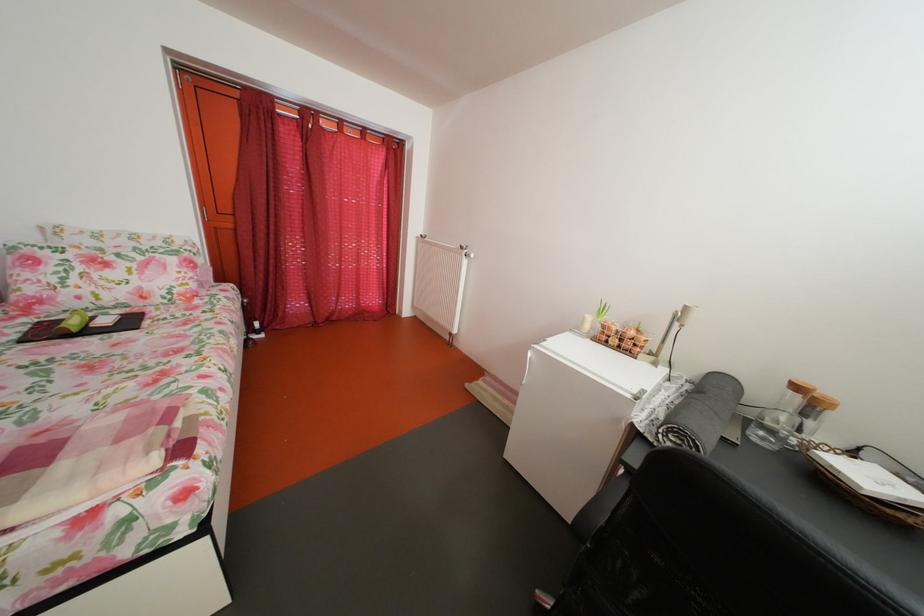
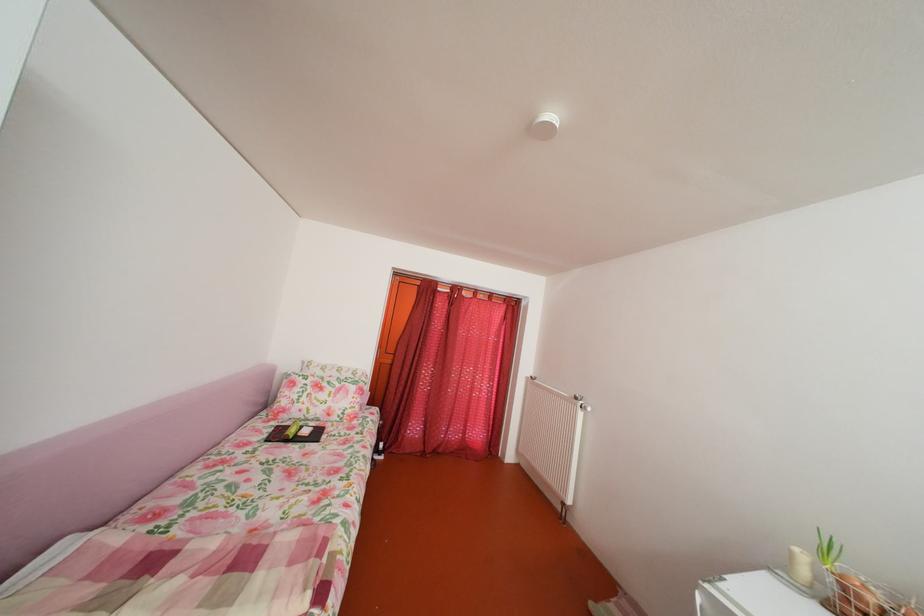
Find the pixel in the second image that matches (x=594, y=325) in the first image.

(803, 561)